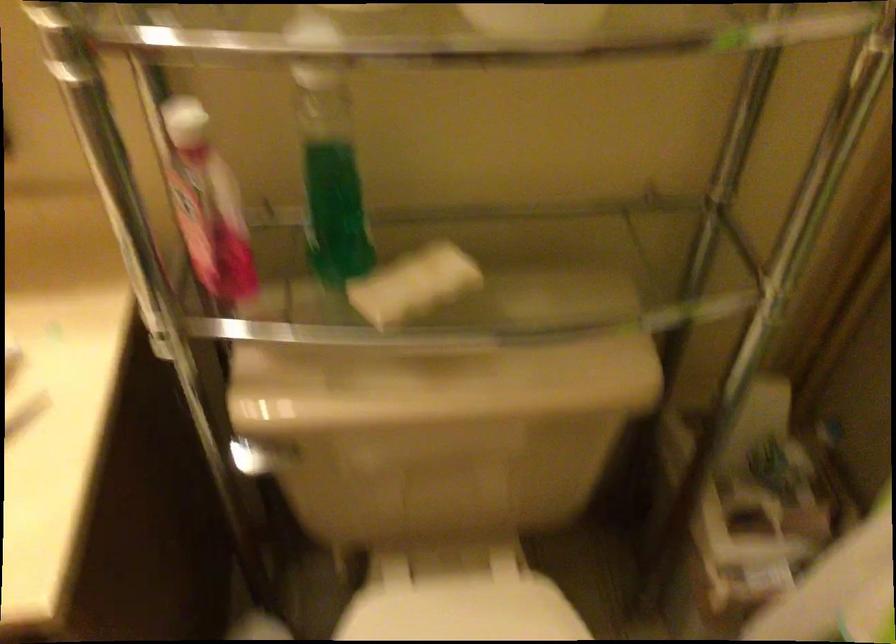
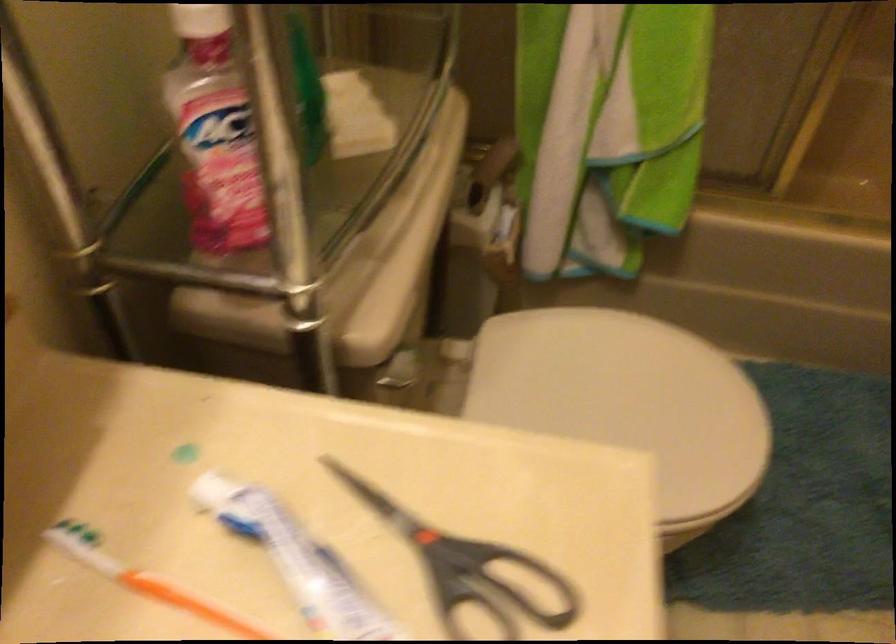
The first image is from the beginning of the video and the second image is from the end. How did the camera likely rotate when shooting the video?

The camera's rotation is toward right-down.